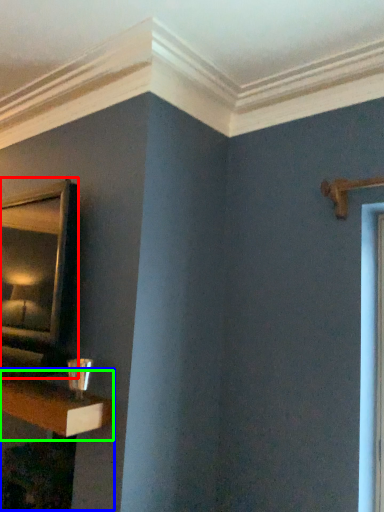
Question: Which object is positioned farthest from mirror (highlighted by a red box)? Select from table (highlighted by a blue box) and shelf (highlighted by a green box).

Choices:
 (A) table
 (B) shelf

Answer: (A)